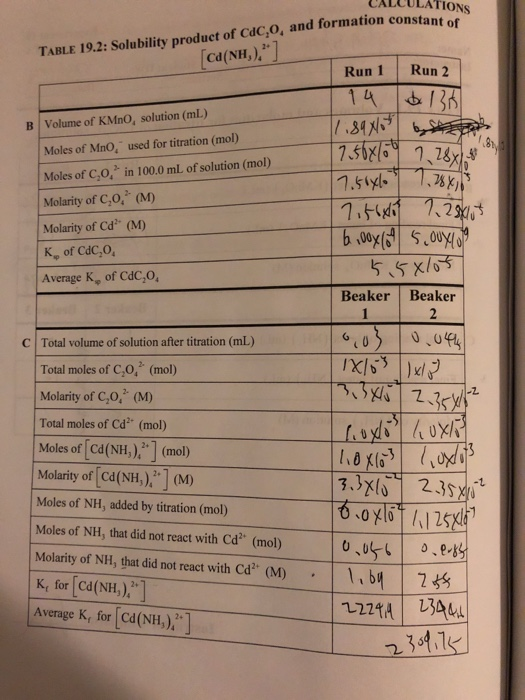
At what (x,y) coordinates should I click in order to perform the action: click on table c. Please return your answer as a coordinate pair (x, y). Looking at the image, I should click on (159, 500).